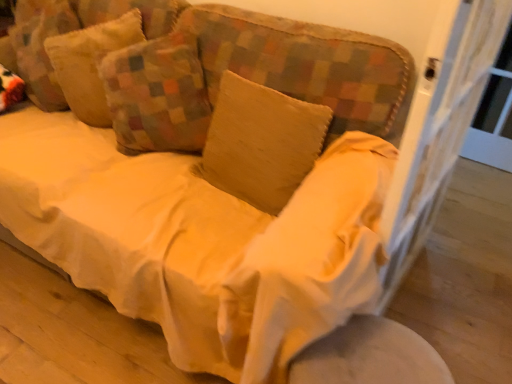
Question: From the image's perspective, does white fabric round table at lower right appear higher than textured beige pillow at upper left, the 3th pillow from the right?

Choices:
 (A) no
 (B) yes

Answer: (A)

Question: Is white fabric round table at lower right at the left side of textured beige pillow at upper left, the 1th pillow when ordered from left to right?

Choices:
 (A) no
 (B) yes

Answer: (A)

Question: Is white fabric round table at lower right shorter than textured beige pillow at upper left, the 1th pillow when ordered from left to right?

Choices:
 (A) no
 (B) yes

Answer: (B)

Question: From a real-world perspective, does white fabric round table at lower right stand above textured beige pillow at upper left, the 1th pillow when ordered from left to right?

Choices:
 (A) yes
 (B) no

Answer: (B)

Question: Is the position of white fabric round table at lower right less distant than that of textured beige pillow at upper left, the 1th pillow when ordered from left to right?

Choices:
 (A) yes
 (B) no

Answer: (A)

Question: Could you tell me if white fabric round table at lower right is facing textured beige pillow at upper left, the 3th pillow from the right?

Choices:
 (A) yes
 (B) no

Answer: (B)

Question: Considering the relative sizes of beige cotton pillow at center, arranged as the 1th pillow when viewed from the right, and white fabric round table at lower right in the image provided, is beige cotton pillow at center, arranged as the 1th pillow when viewed from the right, bigger than white fabric round table at lower right?

Choices:
 (A) no
 (B) yes

Answer: (A)

Question: Can white fabric round table at lower right be found inside beige cotton pillow at center, arranged as the 1th pillow when viewed from the right?

Choices:
 (A) no
 (B) yes

Answer: (A)

Question: Are beige cotton pillow at center, marked as the third pillow in a left-to-right arrangement, and white fabric round table at lower right located far from each other?

Choices:
 (A) yes
 (B) no

Answer: (B)

Question: Is beige cotton pillow at center, marked as the third pillow in a left-to-right arrangement, further to camera compared to white fabric round table at lower right?

Choices:
 (A) yes
 (B) no

Answer: (A)

Question: From the image's perspective, is beige cotton pillow at center, arranged as the 1th pillow when viewed from the right, below white fabric round table at lower right?

Choices:
 (A) yes
 (B) no

Answer: (B)

Question: Considering the relative sizes of beige cotton pillow at center, arranged as the 1th pillow when viewed from the right, and white fabric round table at lower right in the image provided, is beige cotton pillow at center, arranged as the 1th pillow when viewed from the right, thinner than white fabric round table at lower right?

Choices:
 (A) no
 (B) yes

Answer: (B)

Question: Can you see textured beige pillow at upper left, the 3th pillow from the right, touching beige cotton pillow at center, arranged as the 1th pillow when viewed from the right?

Choices:
 (A) no
 (B) yes

Answer: (A)